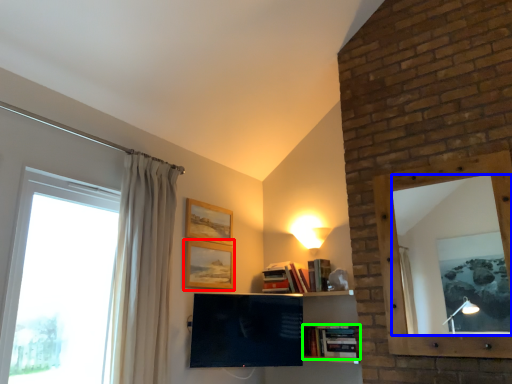
Question: Which is farther away from picture frame (highlighted by a red box)? mirror (highlighted by a blue box) or book (highlighted by a green box)?

Choices:
 (A) mirror
 (B) book

Answer: (A)